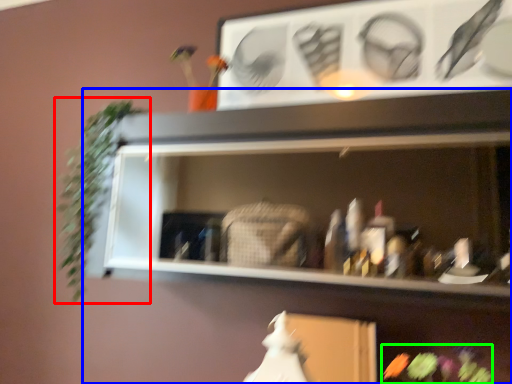
Question: Based on their relative distances, which object is farther from plant (highlighted by a red box)? Choose from shelf (highlighted by a blue box) and flower (highlighted by a green box).

Choices:
 (A) shelf
 (B) flower

Answer: (B)